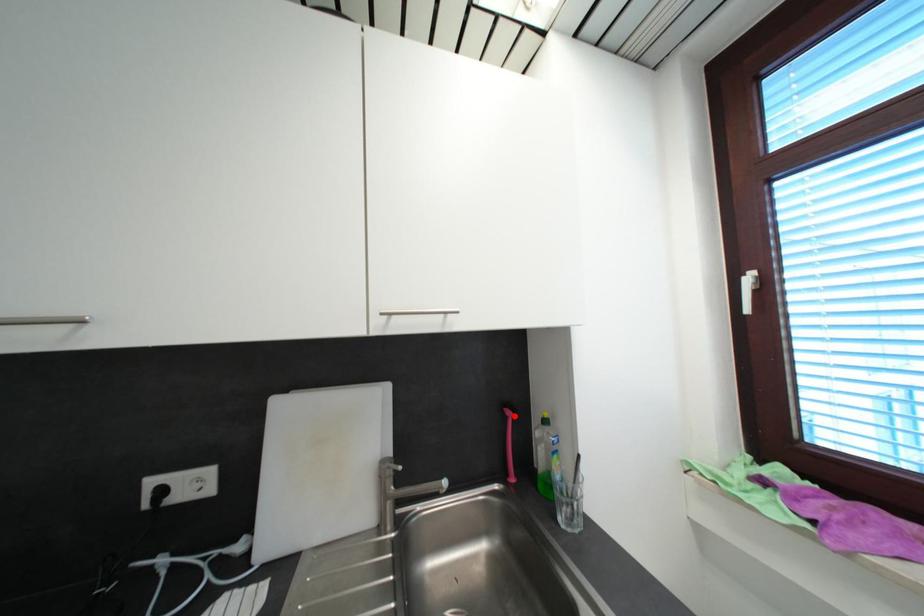
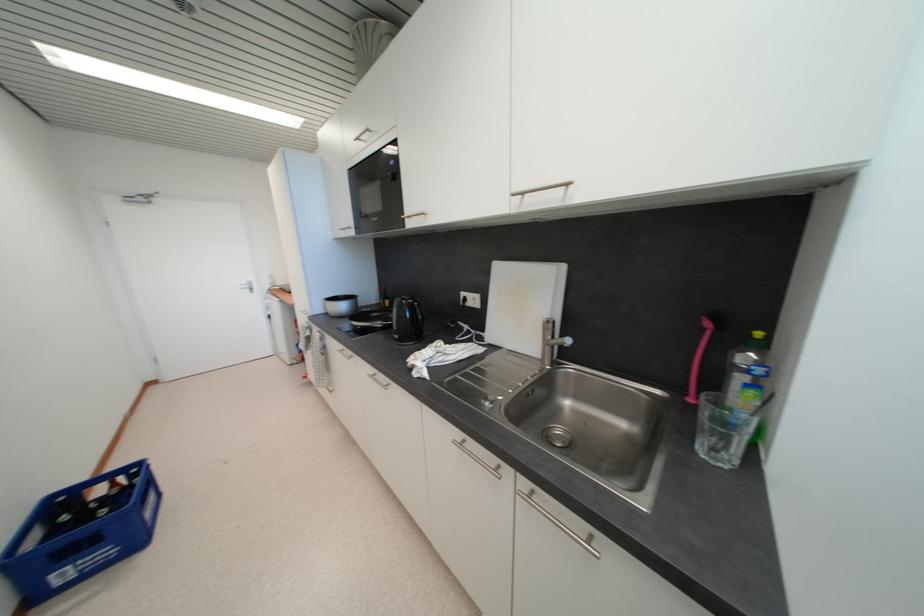
Locate, in the second image, the point that corresponds to the highlighted location in the first image.

(713, 326)